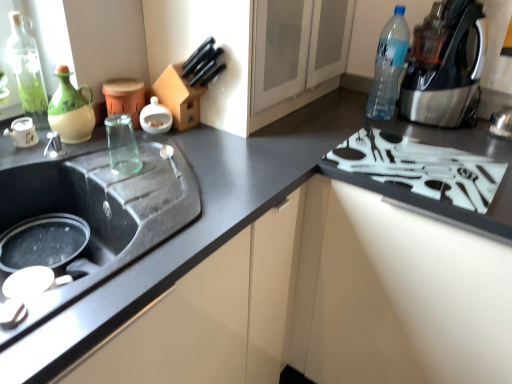
Question: Is matte glass jar at upper left, arranged as the 2th appliance when viewed from the left, at the right side of green glass bottle at upper left, the 1th bottle positioned from the left?

Choices:
 (A) yes
 (B) no

Answer: (A)

Question: Is matte glass jar at upper left, acting as the 2th appliance starting from the right, not near green glass bottle at upper left, the second bottle from the right?

Choices:
 (A) yes
 (B) no

Answer: (B)

Question: Is matte glass jar at upper left, arranged as the 2th appliance when viewed from the left, next to green glass bottle at upper left, the second bottle from the right, and touching it?

Choices:
 (A) no
 (B) yes

Answer: (A)

Question: From the image's perspective, is matte glass jar at upper left, acting as the 2th appliance starting from the right, below green glass bottle at upper left, the second bottle from the right?

Choices:
 (A) yes
 (B) no

Answer: (A)

Question: From a real-world perspective, is matte glass jar at upper left, acting as the 2th appliance starting from the right, beneath green glass bottle at upper left, the second bottle from the right?

Choices:
 (A) no
 (B) yes

Answer: (B)

Question: From a real-world perspective, is matte glass jar at upper left, arranged as the 2th appliance when viewed from the left, physically above green glass bottle at upper left, the 1th bottle positioned from the left?

Choices:
 (A) no
 (B) yes

Answer: (A)

Question: From a real-world perspective, is white matte teapot at left, placed as the third appliance when sorted from right to left, below black matte sink at left?

Choices:
 (A) no
 (B) yes

Answer: (A)

Question: From the image's perspective, is white matte teapot at left, placed as the third appliance when sorted from right to left, under black matte sink at left?

Choices:
 (A) no
 (B) yes

Answer: (A)

Question: Can you confirm if white matte teapot at left, marked as the first appliance in a left-to-right arrangement, is shorter than black matte sink at left?

Choices:
 (A) yes
 (B) no

Answer: (A)

Question: Is white matte teapot at left, placed as the third appliance when sorted from right to left, aimed at black matte sink at left?

Choices:
 (A) no
 (B) yes

Answer: (B)

Question: Does white matte teapot at left, marked as the first appliance in a left-to-right arrangement, have a smaller size compared to black matte sink at left?

Choices:
 (A) no
 (B) yes

Answer: (B)

Question: Is white matte teapot at left, marked as the first appliance in a left-to-right arrangement, thinner than black matte sink at left?

Choices:
 (A) no
 (B) yes

Answer: (B)

Question: From a real-world perspective, is green glass bottle at upper left, the second bottle from the right, located higher than matte glass jar at upper left, acting as the 2th appliance starting from the right?

Choices:
 (A) yes
 (B) no

Answer: (A)